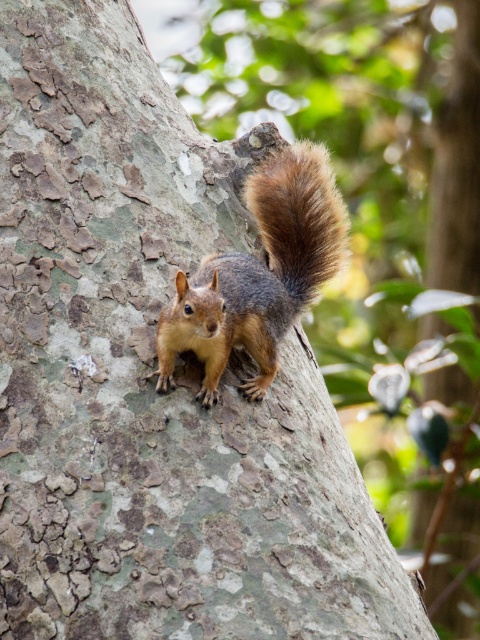
Can you confirm if shiny brown fur squirrel at center is taller than fuzzy brown tail at upper right?

Indeed, shiny brown fur squirrel at center has a greater height compared to fuzzy brown tail at upper right.

Describe the element at coordinates (260, 273) in the screenshot. I see `shiny brown fur squirrel at center` at that location.

Locate an element on the screen. shiny brown fur squirrel at center is located at coordinates (260, 273).